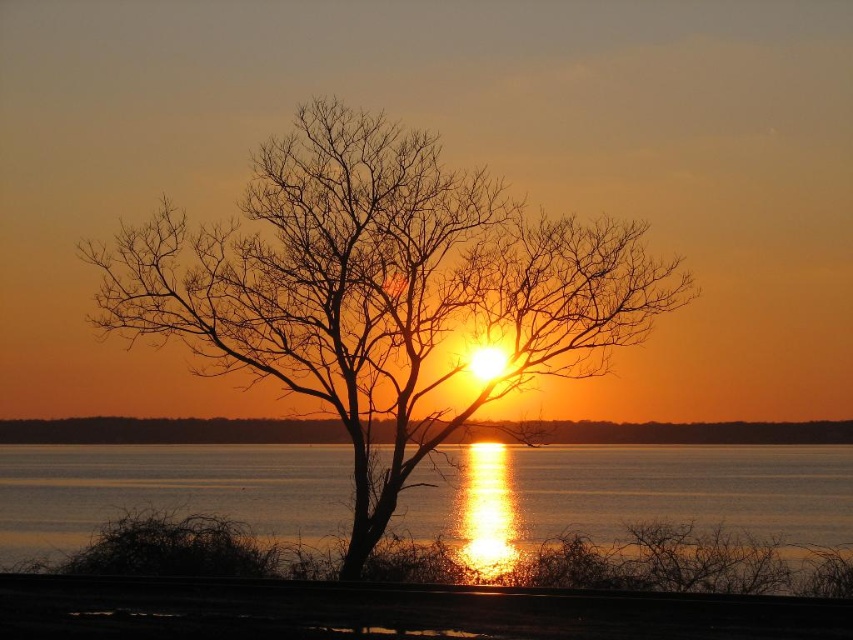
In the scene shown: Does smooth water at center have a lesser height compared to smooth orange sky at center?

No, smooth water at center is not shorter than smooth orange sky at center.

Does smooth water at center appear over smooth orange sky at center?

No, smooth water at center is not above smooth orange sky at center.

Where is `smooth water at center`? smooth water at center is located at coordinates [630, 492].

The height and width of the screenshot is (640, 853). Describe the element at coordinates (383, 291) in the screenshot. I see `brown/dry wood tree at center` at that location.

What are the coordinates of `brown/dry wood tree at center` in the screenshot? It's located at (383, 291).

Does brown/dry wood tree at center have a lesser height compared to smooth water at center?

Incorrect, brown/dry wood tree at center's height does not fall short of smooth water at center's.

Is brown/dry wood tree at center below smooth water at center?

Incorrect, brown/dry wood tree at center is not positioned below smooth water at center.

Is point (418, 177) less distant than point (312, 449)?

Yes, point (418, 177) is in front of point (312, 449).

Where is `brown/dry wood tree at center`? The height and width of the screenshot is (640, 853). brown/dry wood tree at center is located at coordinates (383, 291).